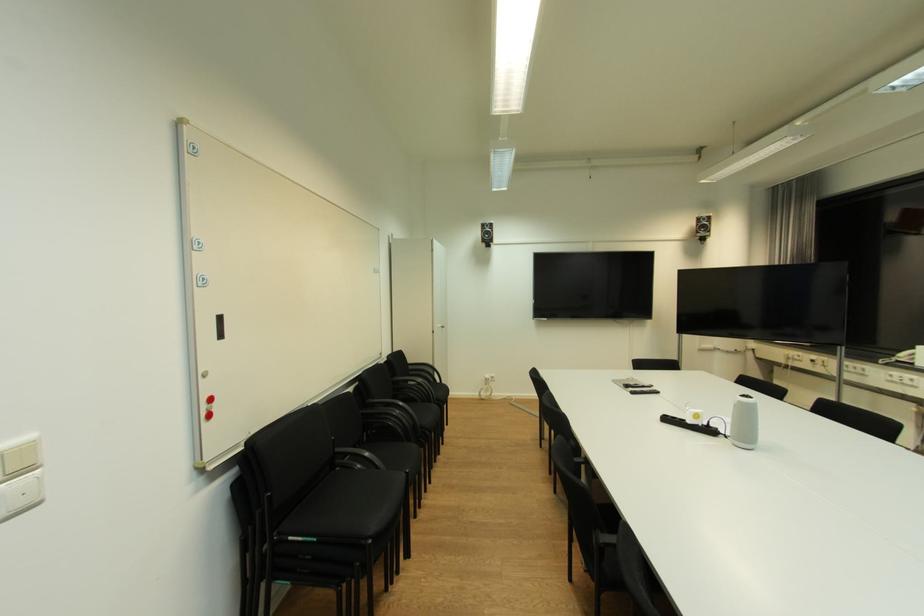
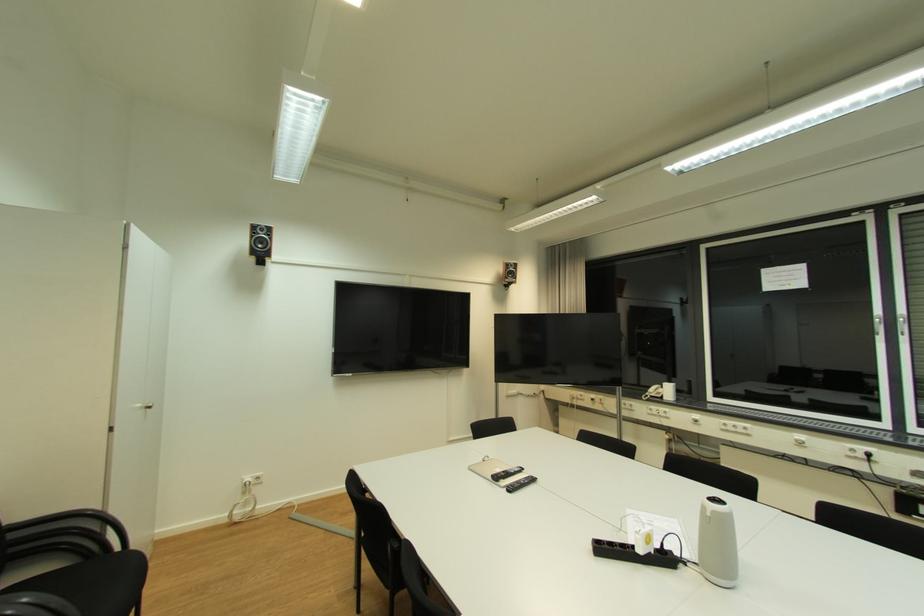
Find the pixel in the second image that matches point 492,377 in the first image.

(253, 480)